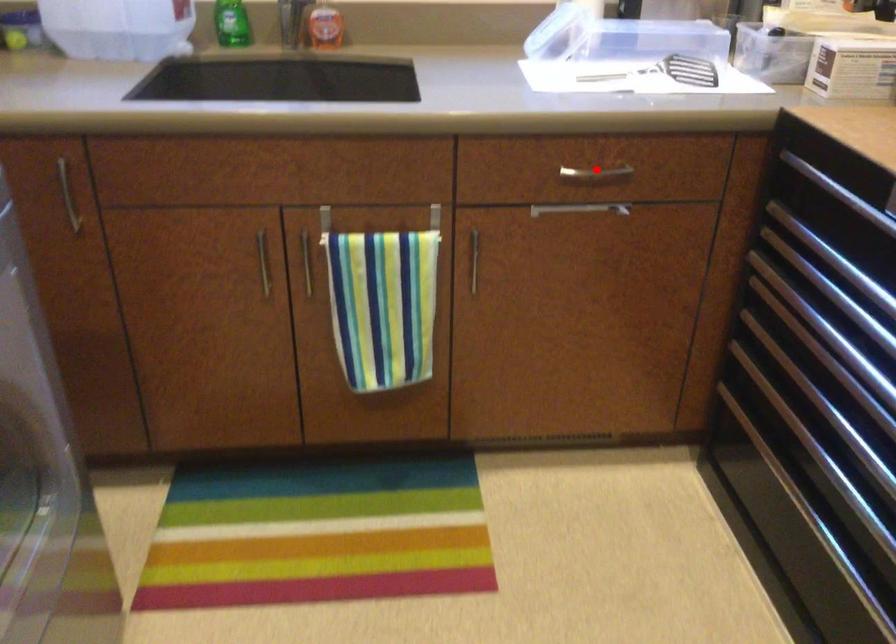
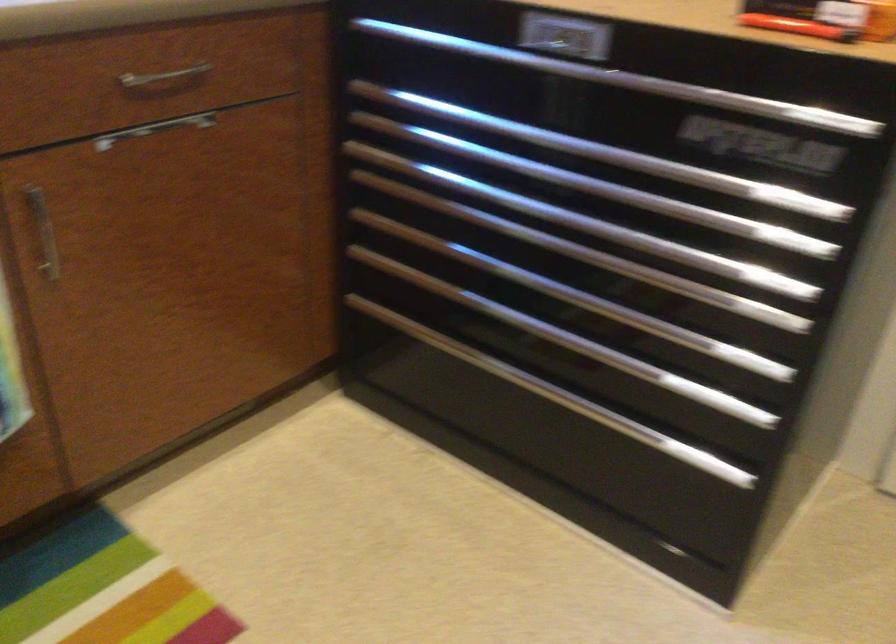
Question: I am providing you with two images of the same scene from different viewpoints. Image1 has a red point marked. In image2, the corresponding 3D location appears at what relative position? Reply with the corresponding letter.

Choices:
 (A) Closer
 (B) Farther

Answer: (A)